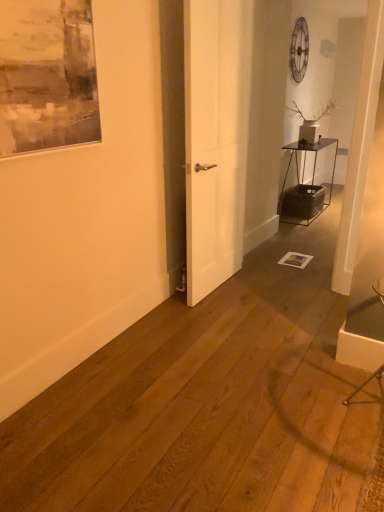
In order to click on vacant space underneath metallic silver armchair at lower right (from a real-world perspective) in this screenshot , I will do `click(364, 390)`.